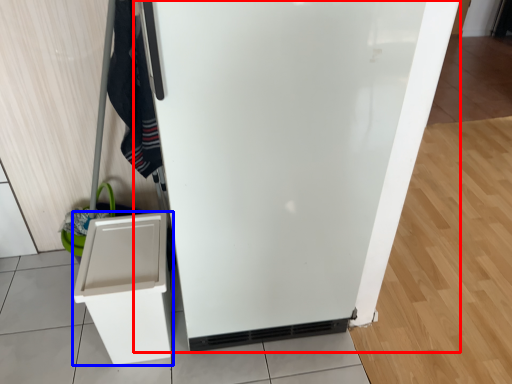
Question: Which of the following is the farthest to the observer, refrigerator (highlighted by a red box) or cabinetry (highlighted by a blue box)?

Choices:
 (A) refrigerator
 (B) cabinetry

Answer: (B)